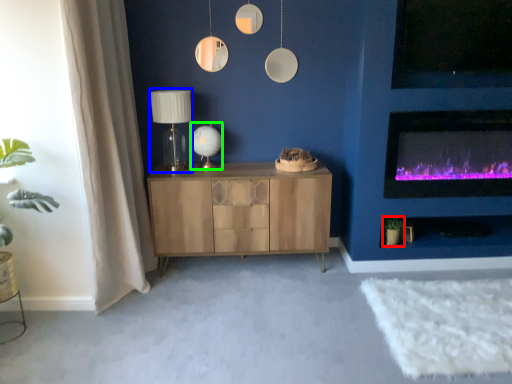
Question: Which object is the closest to the plant (highlighted by a red box)? Choose among these: table lamp (highlighted by a blue box) or table lamp (highlighted by a green box).

Choices:
 (A) table lamp
 (B) table lamp

Answer: (B)